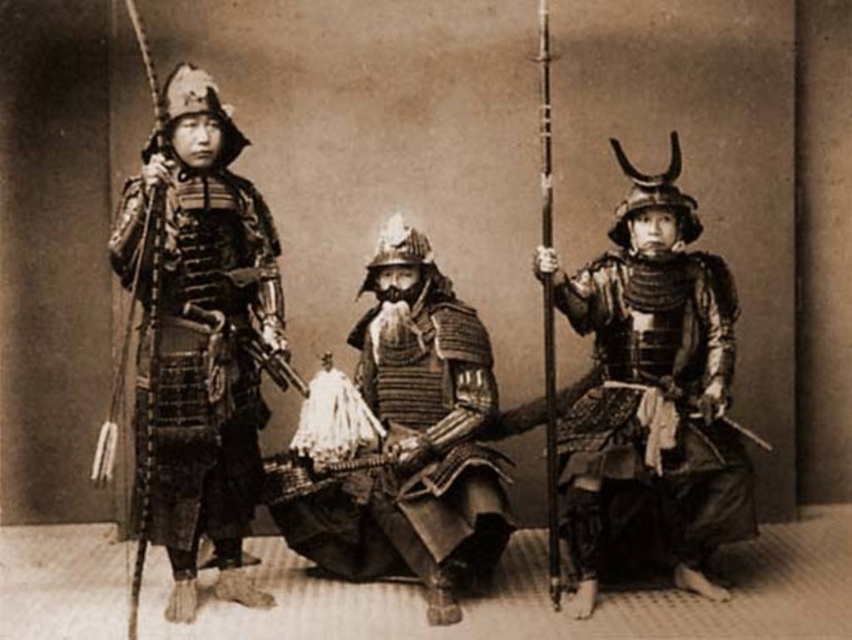
Does polished metal armor at left lie behind shiny metallic armor at center?

That is False.

Between polished metal armor at left and shiny metallic armor at center, which one is positioned higher?

Positioned higher is polished metal armor at left.

Describe the element at coordinates (205, 337) in the screenshot. The height and width of the screenshot is (640, 852). I see `polished metal armor at left` at that location.

Identify the location of polished metal armor at left. The height and width of the screenshot is (640, 852). (205, 337).

Who is higher up, polished metal armor at left or shiny silver armor at right?

polished metal armor at left is higher up.

Can you confirm if polished metal armor at left is thinner than shiny silver armor at right?

Yes, polished metal armor at left is thinner than shiny silver armor at right.

Is point (191, 598) positioned before point (599, 406)?

Yes, point (191, 598) is in front of point (599, 406).

Image resolution: width=852 pixels, height=640 pixels. What are the coordinates of `polished metal armor at left` in the screenshot? It's located at (205, 337).

Between shiny silver armor at right and shiny metallic armor at center, which one appears on the left side from the viewer's perspective?

shiny metallic armor at center

What do you see at coordinates (653, 410) in the screenshot? Image resolution: width=852 pixels, height=640 pixels. I see `shiny silver armor at right` at bounding box center [653, 410].

Identify the location of shiny silver armor at right. The height and width of the screenshot is (640, 852). (653, 410).